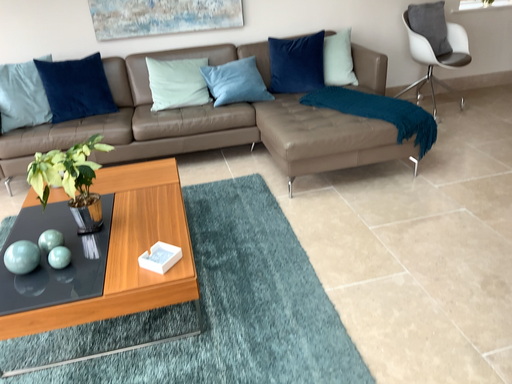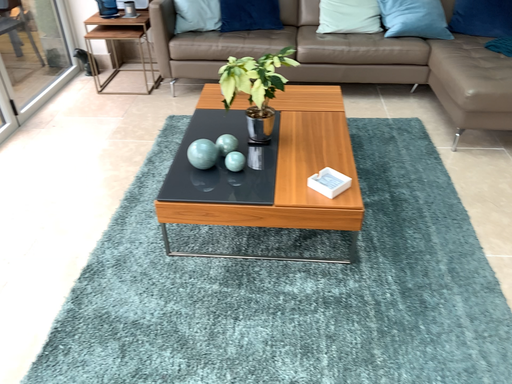
Question: Which way did the camera rotate in the video?

Choices:
 (A) rotated right
 (B) rotated left

Answer: (B)